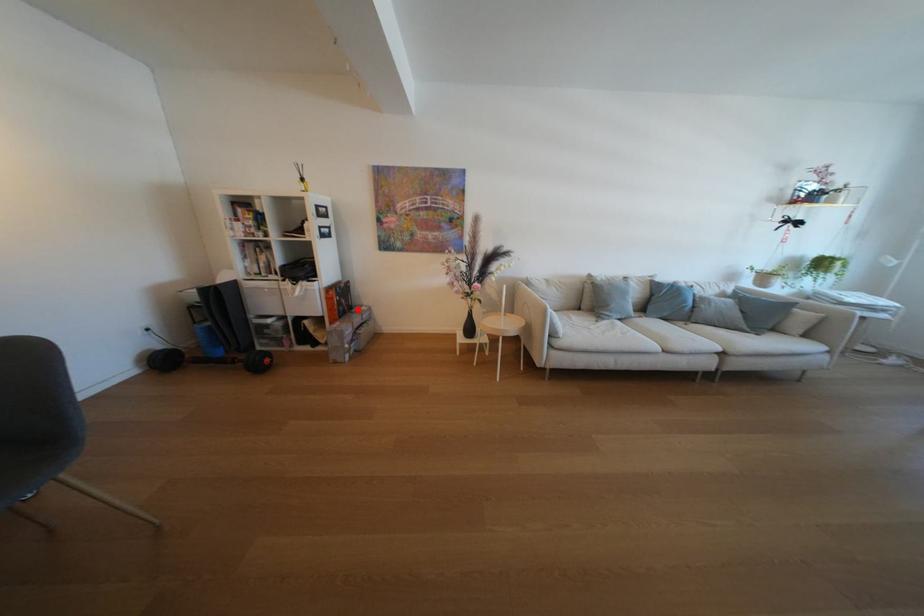
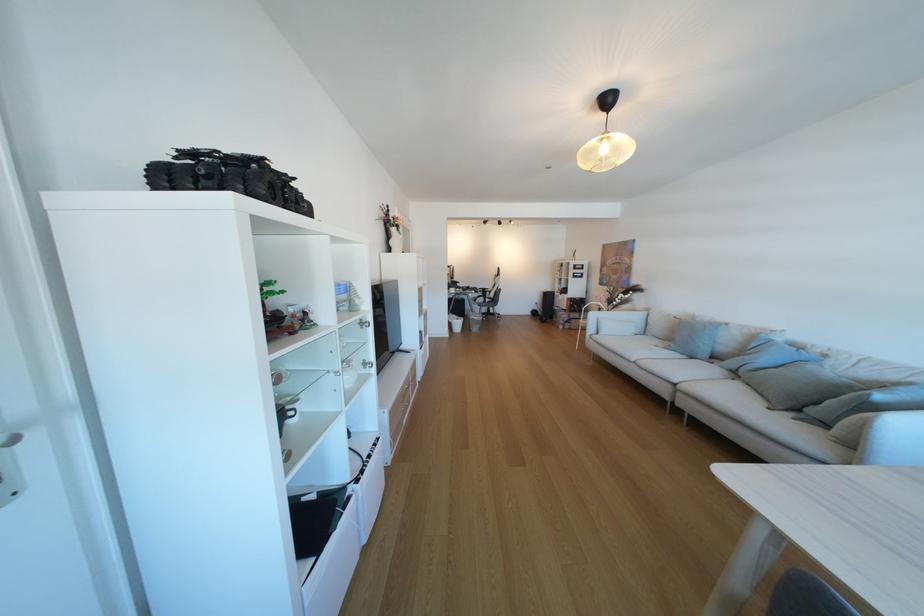
Question: I am providing you with two images of the same scene from different viewpoints. A red point is shown in image1. For the corresponding object point in image2, is it positioned nearer or farther from the camera?

Choices:
 (A) Nearer
 (B) Farther

Answer: (B)